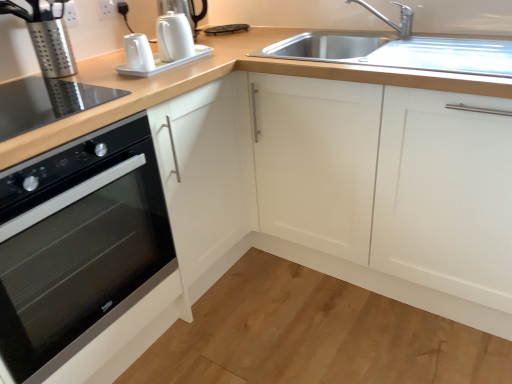
Where is `vacant area on top of smooth wood floor at lower center (from a real-world perspective)`? This screenshot has height=384, width=512. vacant area on top of smooth wood floor at lower center (from a real-world perspective) is located at coordinates (286, 327).